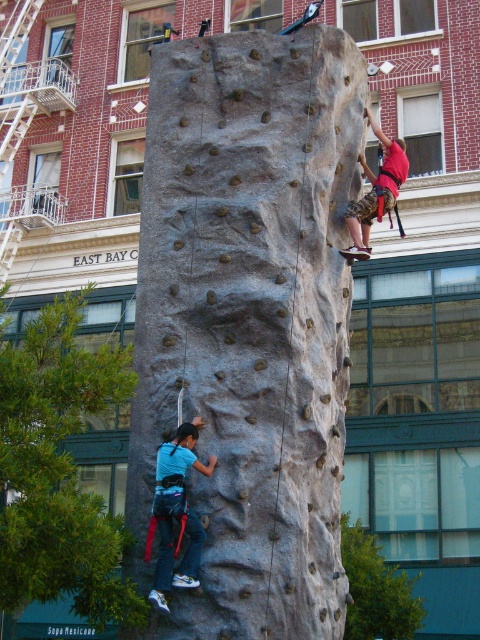
I want to click on smooth gray rock climbing at center, so click(x=250, y=320).

Between smooth gray rock climbing at center and red fabric harness at upper right, which one is positioned higher?

Positioned higher is red fabric harness at upper right.

This screenshot has width=480, height=640. What are the coordinates of `smooth gray rock climbing at center` in the screenshot? It's located at (250, 320).

Is blue fabric climbing harness at lower left smaller than red fabric harness at upper right?

Yes, blue fabric climbing harness at lower left is smaller than red fabric harness at upper right.

Who is higher up, blue fabric climbing harness at lower left or red fabric harness at upper right?

red fabric harness at upper right

Who is more forward, (151,534) or (381,184)?

Point (151,534) is in front.

This screenshot has width=480, height=640. What are the coordinates of `blue fabric climbing harness at lower left` in the screenshot? It's located at (177, 512).

In the scene shown: Does smooth gray rock climbing at center appear on the left side of blue fabric climbing harness at lower left?

No, smooth gray rock climbing at center is not to the left of blue fabric climbing harness at lower left.

Is smooth gray rock climbing at center taller than blue fabric climbing harness at lower left?

Yes.

Measure the distance between point (334, 86) and camera.

The distance of point (334, 86) from camera is 29.16 meters.

This screenshot has width=480, height=640. I want to click on smooth gray rock climbing at center, so click(250, 320).